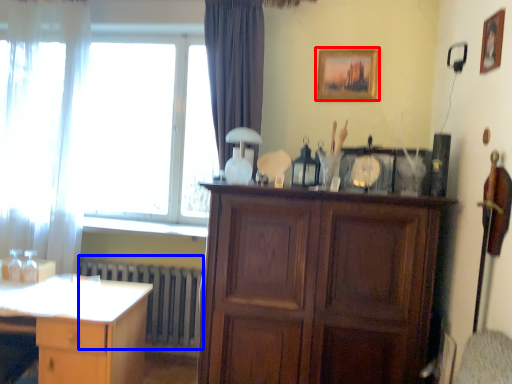
Question: Which object appears farthest to the camera in this image, picture frame (highlighted by a red box) or radiator (highlighted by a blue box)?

Choices:
 (A) picture frame
 (B) radiator

Answer: (B)